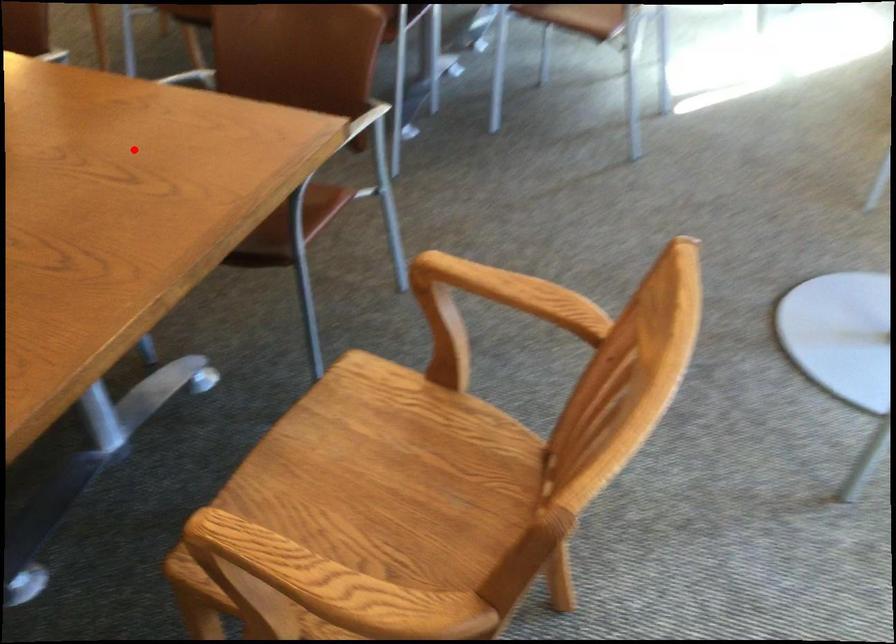
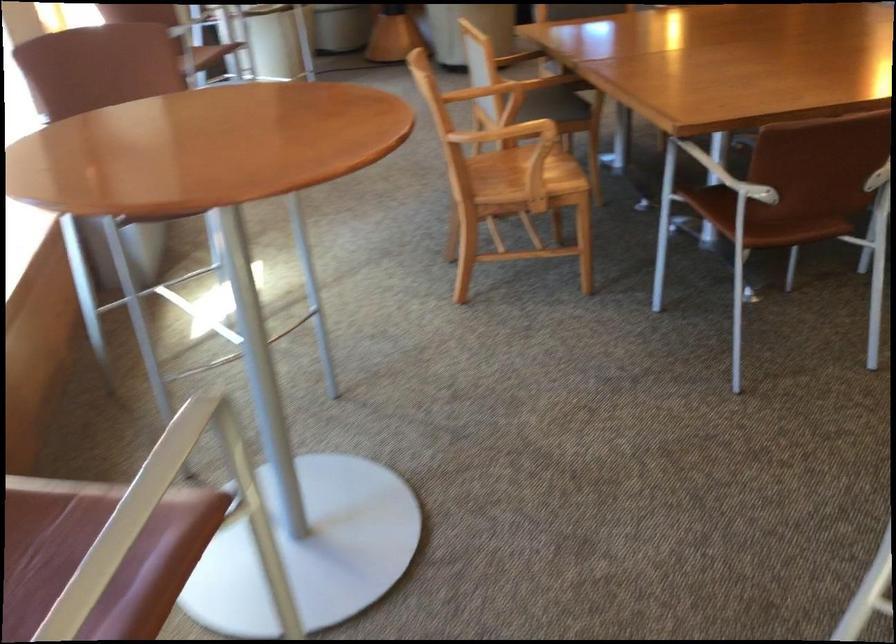
Question: I am providing you with two images of the same scene from different viewpoints. Image1 has a red point marked. In image2, the corresponding 3D location appears at what relative position? Reply with the corresponding letter.

Choices:
 (A) Closer
 (B) Farther

Answer: (B)